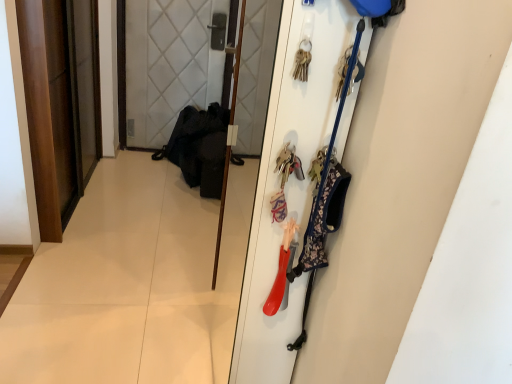
Question: From the image's perspective, is matte plastic door at right, the 2th door viewed from the left, above wooden screen door at center?

Choices:
 (A) no
 (B) yes

Answer: (A)

Question: Does matte plastic door at right, the second door in the back-to-front sequence, have a greater width compared to wooden screen door at center?

Choices:
 (A) no
 (B) yes

Answer: (B)

Question: Considering the relative sizes of matte plastic door at right, which appears as the first door when viewed from the front, and wooden screen door at center in the image provided, is matte plastic door at right, which appears as the first door when viewed from the front, smaller than wooden screen door at center?

Choices:
 (A) no
 (B) yes

Answer: (A)

Question: Is wooden screen door at center a part of matte plastic door at right, the second door in the back-to-front sequence?

Choices:
 (A) no
 (B) yes

Answer: (A)

Question: Is matte plastic door at right, the first door from the right, far from wooden screen door at center?

Choices:
 (A) yes
 (B) no

Answer: (A)

Question: Is matte plastic door at right, which appears as the first door when viewed from the front, looking in the opposite direction of wooden screen door at center?

Choices:
 (A) yes
 (B) no

Answer: (B)

Question: From the image's perspective, is wooden door at left, the first door when ordered from back to front, above wooden screen door at center?

Choices:
 (A) no
 (B) yes

Answer: (B)

Question: Is wooden door at left, the 2th door from the right, not inside wooden screen door at center?

Choices:
 (A) no
 (B) yes

Answer: (B)

Question: Can you confirm if wooden door at left, the first door when ordered from back to front, is smaller than wooden screen door at center?

Choices:
 (A) no
 (B) yes

Answer: (A)

Question: Does wooden door at left, the 1th door in the left-to-right sequence, have a greater width compared to wooden screen door at center?

Choices:
 (A) no
 (B) yes

Answer: (B)

Question: Is wooden door at left, the 1th door in the left-to-right sequence, not close to wooden screen door at center?

Choices:
 (A) yes
 (B) no

Answer: (A)

Question: Is the surface of wooden door at left, the 2th door from the right, in direct contact with wooden screen door at center?

Choices:
 (A) no
 (B) yes

Answer: (A)

Question: Is wooden screen door at center taller than wooden door at left, acting as the 2th door starting from the front?

Choices:
 (A) no
 (B) yes

Answer: (B)